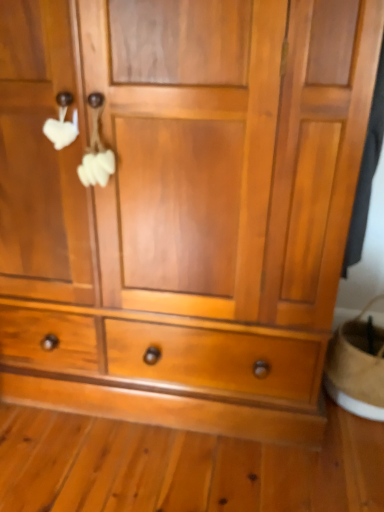
Describe the element at coordinates (317, 155) in the screenshot. The image size is (384, 512). I see `black matte screen door at right` at that location.

Locate an element on the screen. black matte screen door at right is located at coordinates (317, 155).

Where is `black matte screen door at right`? Image resolution: width=384 pixels, height=512 pixels. black matte screen door at right is located at coordinates (317, 155).